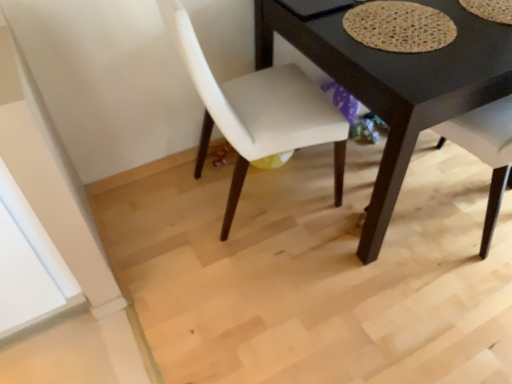
Identify the location of white fabric chair at center. (257, 110).

What do you see at coordinates (397, 85) in the screenshot? I see `black matte table at center` at bounding box center [397, 85].

Where is `textured beige mat at upper right`? This screenshot has width=512, height=384. textured beige mat at upper right is located at coordinates (399, 26).

Is black matte table at center to the right of white fabric chair at center from the viewer's perspective?

Yes, black matte table at center is to the right of white fabric chair at center.

From the image's perspective, which one is positioned higher, black matte table at center or white fabric chair at center?

black matte table at center appears higher in the image.

Identify the location of chair to the left of black matte table at center. (257, 110).

Locate an element on the screen. This screenshot has height=384, width=512. chair lying on the left of textured beige mat at upper right is located at coordinates (257, 110).

How many degrees apart are the facing directions of white fabric chair at center and textured beige mat at upper right?

white fabric chair at center and textured beige mat at upper right are facing 85.4 degrees away from each other.

Can you confirm if white fabric chair at center is positioned to the left of textured beige mat at upper right?

Yes.

Which is correct: black matte table at center is inside textured beige mat at upper right, or outside of it?

black matte table at center is located beyond the bounds of textured beige mat at upper right.

Is point (456, 17) less distant than point (407, 7)?

That is True.

Is black matte table at center not near textured beige mat at upper right?

They are positioned close to each other.

Is black matte table at center looking in the opposite direction of textured beige mat at upper right?

No.

Is white fabric chair at center looking in the opposite direction of black matte table at center?

No, white fabric chair at center is not facing the opposite direction of black matte table at center.

Between white fabric chair at center and black matte table at center, which one appears on the right side from the viewer's perspective?

black matte table at center.

Is white fabric chair at center positioned before black matte table at center?

That is True.

Looking at the image, does textured beige mat at upper right seem bigger or smaller compared to white fabric chair at center?

Considering their sizes, textured beige mat at upper right takes up less space than white fabric chair at center.

Is white fabric chair at center located within textured beige mat at upper right?

No, textured beige mat at upper right does not contain white fabric chair at center.

Considering the relative positions of textured beige mat at upper right and white fabric chair at center in the image provided, is textured beige mat at upper right to the left of white fabric chair at center from the viewer's perspective?

In fact, textured beige mat at upper right is to the right of white fabric chair at center.

In the scene shown: How many degrees apart are the facing directions of textured beige mat at upper right and white fabric chair at center?

The angle between the facing direction of textured beige mat at upper right and the facing direction of white fabric chair at center is 85.4 degrees.

Is textured beige mat at upper right in contact with black matte table at center?

No, textured beige mat at upper right is not beside black matte table at center.

From a real-world perspective, which is physically above, textured beige mat at upper right or black matte table at center?

textured beige mat at upper right, from a real-world perspective.

How many degrees apart are the facing directions of textured beige mat at upper right and black matte table at center?

2.2 degrees.

Can you confirm if textured beige mat at upper right is smaller than black matte table at center?

Yes, textured beige mat at upper right is smaller than black matte table at center.

Where is `table below the white fabric chair at center (from a real-world perspective)`? table below the white fabric chair at center (from a real-world perspective) is located at coordinates (397, 85).

This screenshot has height=384, width=512. In order to click on mat above the white fabric chair at center (from a real-world perspective) in this screenshot , I will do `click(399, 26)`.

Estimate the real-world distances between objects in this image. Which object is further from black matte table at center, textured beige mat at upper right or white fabric chair at center?

Among the two, white fabric chair at center is located further to black matte table at center.

From the image, which object appears to be nearer to black matte table at center, white fabric chair at center or textured beige mat at upper right?

textured beige mat at upper right lies closer to black matte table at center than the other object.

When comparing their distances from white fabric chair at center, does textured beige mat at upper right or black matte table at center seem further?

The object further to white fabric chair at center is textured beige mat at upper right.

Looking at the image, which one is located closer to textured beige mat at upper right, black matte table at center or white fabric chair at center?

The object closer to textured beige mat at upper right is black matte table at center.

Estimate the real-world distances between objects in this image. Which object is closer to textured beige mat at upper right, white fabric chair at center or black matte table at center?

Among the two, black matte table at center is located nearer to textured beige mat at upper right.

Looking at the image, which one is located further to white fabric chair at center, black matte table at center or textured beige mat at upper right?

textured beige mat at upper right.

Where is `mat located between white fabric chair at center and black matte table at center in the left-right direction`? This screenshot has height=384, width=512. mat located between white fabric chair at center and black matte table at center in the left-right direction is located at coordinates (399, 26).